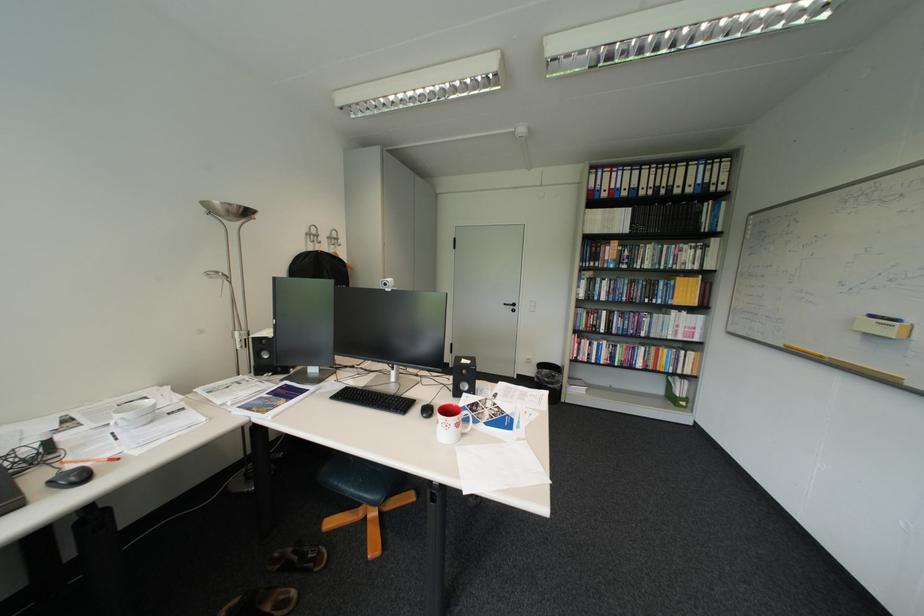
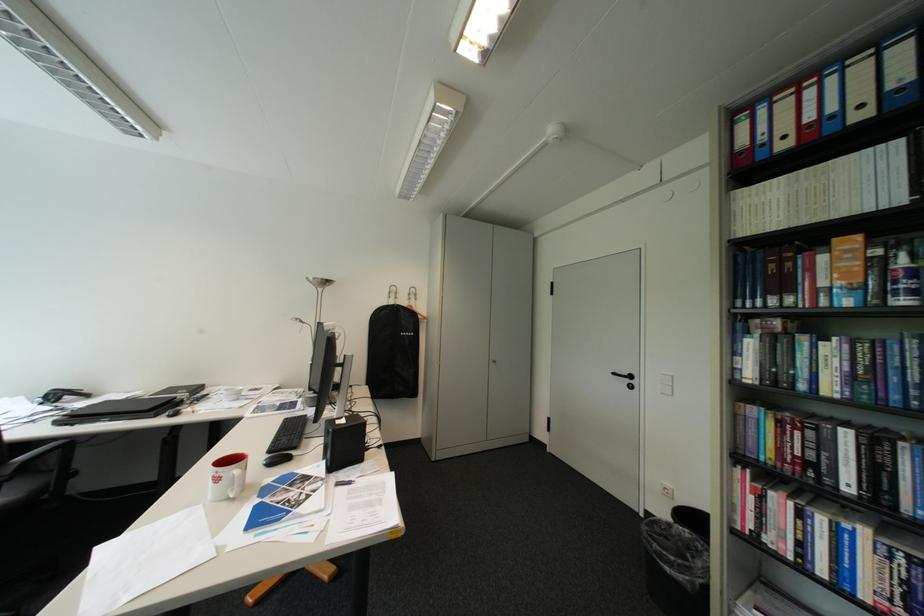
In the second image, find the point that corresponds to (x=617, y=191) in the first image.

(796, 138)